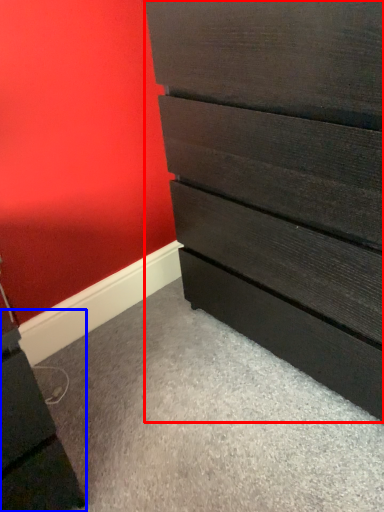
Question: Which object appears farthest to the camera in this image, chest of drawers (highlighted by a red box) or file cabinet (highlighted by a blue box)?

Choices:
 (A) chest of drawers
 (B) file cabinet

Answer: (B)